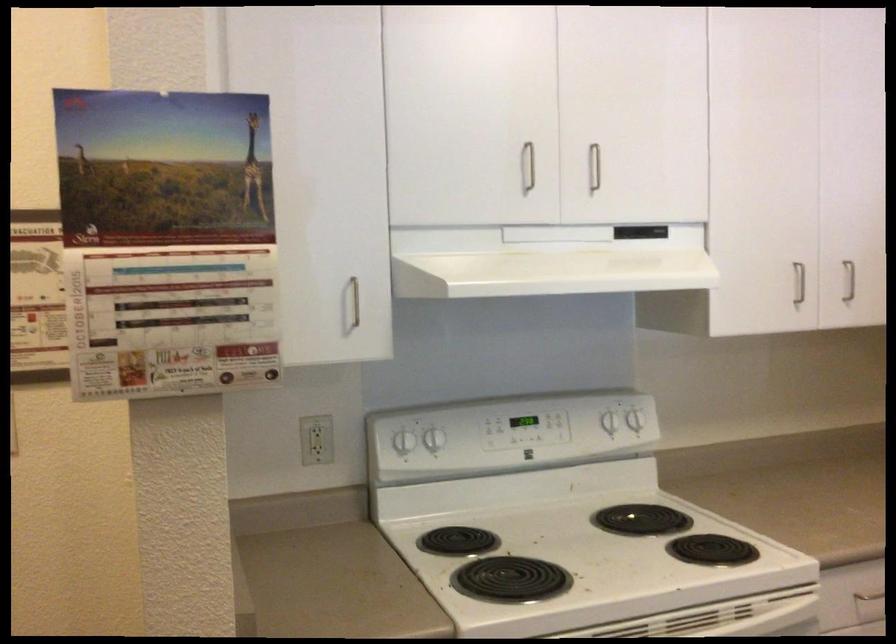
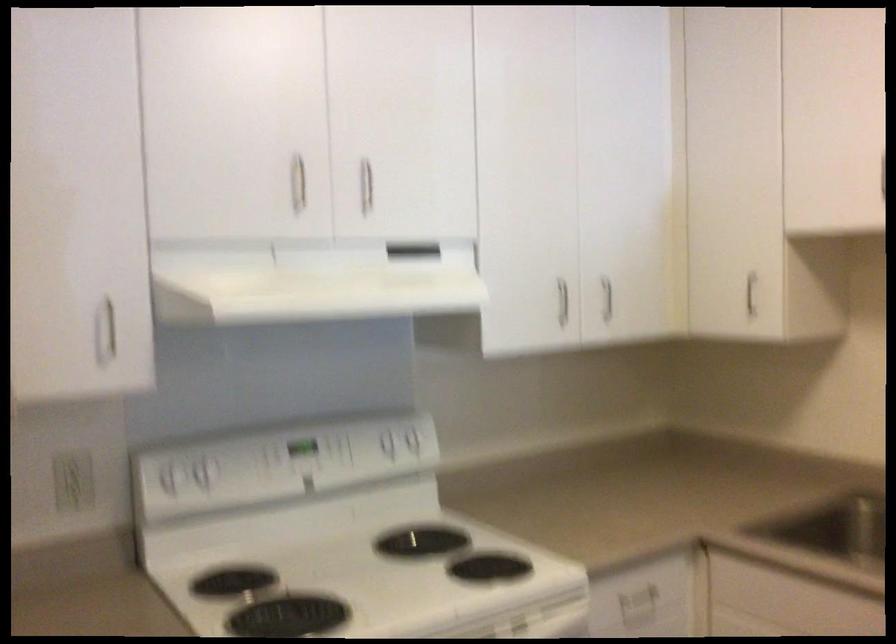
Where in the second image is the point corresponding to point 595,162 from the first image?

(366, 185)